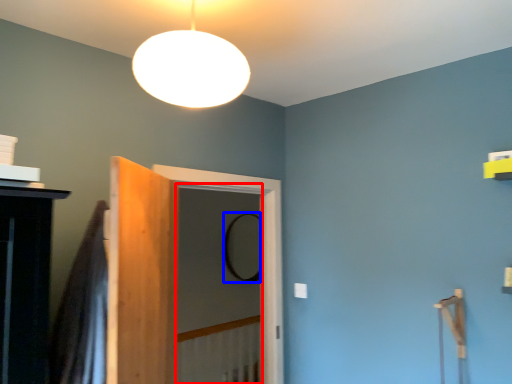
Question: Which point is further to the camera, screen door (highlighted by a red box) or mirror (highlighted by a blue box)?

Choices:
 (A) screen door
 (B) mirror

Answer: (B)